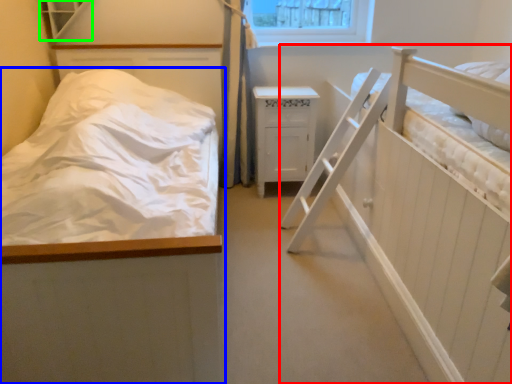
Question: Which object is positioned closest to hospital bed (highlighted by a red box)? Select from bed (highlighted by a blue box) and window (highlighted by a green box).

Choices:
 (A) bed
 (B) window

Answer: (A)